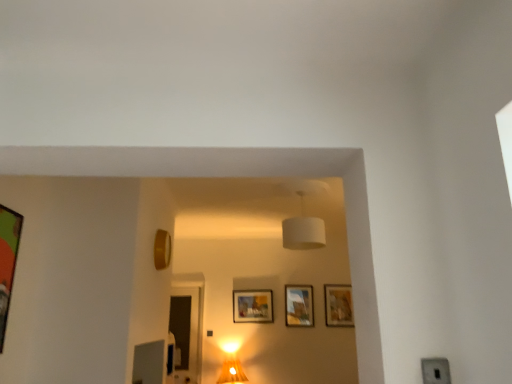
Question: From a real-world perspective, is green matte picture frame at left, arranged as the fifth picture frame when viewed from the back, positioned over matte wooden picture frame at center, marked as the fourth picture frame in a front-to-back arrangement, based on gravity?

Choices:
 (A) no
 (B) yes

Answer: (B)

Question: Can you confirm if green matte picture frame at left, arranged as the fifth picture frame when viewed from the back, is positioned to the left of matte wooden picture frame at center, which is the second picture frame in right-to-left order?

Choices:
 (A) no
 (B) yes

Answer: (B)

Question: Is green matte picture frame at left, arranged as the fifth picture frame when viewed from the back, outside matte wooden picture frame at center, which is the second picture frame in right-to-left order?

Choices:
 (A) yes
 (B) no

Answer: (A)

Question: Is green matte picture frame at left, acting as the first picture frame starting from the left, not close to matte wooden picture frame at center, which is the second picture frame in right-to-left order?

Choices:
 (A) yes
 (B) no

Answer: (A)

Question: Does green matte picture frame at left, arranged as the fifth picture frame when viewed from the back, have a greater width compared to matte wooden picture frame at center, which is the second picture frame in right-to-left order?

Choices:
 (A) no
 (B) yes

Answer: (B)

Question: From the image's perspective, is green matte picture frame at left, arranged as the fifth picture frame when viewed from the back, located beneath matte wooden picture frame at center, acting as the 4th picture frame starting from the left?

Choices:
 (A) no
 (B) yes

Answer: (A)

Question: Is gold metallic picture frame at upper center, which ranks as the 4th picture frame in back-to-front order, taller than transparent glass door at center?

Choices:
 (A) no
 (B) yes

Answer: (A)

Question: Is gold metallic picture frame at upper center, the fourth picture frame from the right, at the right side of transparent glass door at center?

Choices:
 (A) yes
 (B) no

Answer: (A)

Question: Is gold metallic picture frame at upper center, arranged as the second picture frame when viewed from the front, oriented away from transparent glass door at center?

Choices:
 (A) yes
 (B) no

Answer: (B)

Question: From a real-world perspective, does gold metallic picture frame at upper center, arranged as the second picture frame when viewed from the front, sit lower than transparent glass door at center?

Choices:
 (A) no
 (B) yes

Answer: (A)

Question: Can you confirm if gold metallic picture frame at upper center, the fourth picture frame from the right, is bigger than transparent glass door at center?

Choices:
 (A) no
 (B) yes

Answer: (A)

Question: Is the depth of gold metallic picture frame at upper center, the fourth picture frame from the right, less than that of transparent glass door at center?

Choices:
 (A) no
 (B) yes

Answer: (B)

Question: Is matte wooden picture frame at center, which appears as the 3th picture frame when viewed from the back, closer to camera compared to matte wooden picture frame at center, which is the 2th picture frame from back to front?

Choices:
 (A) no
 (B) yes

Answer: (B)